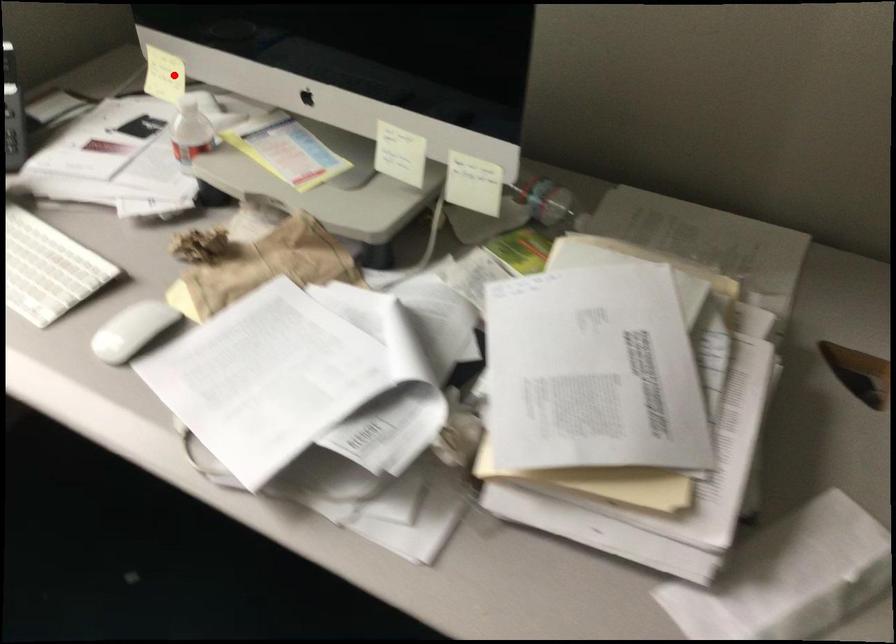
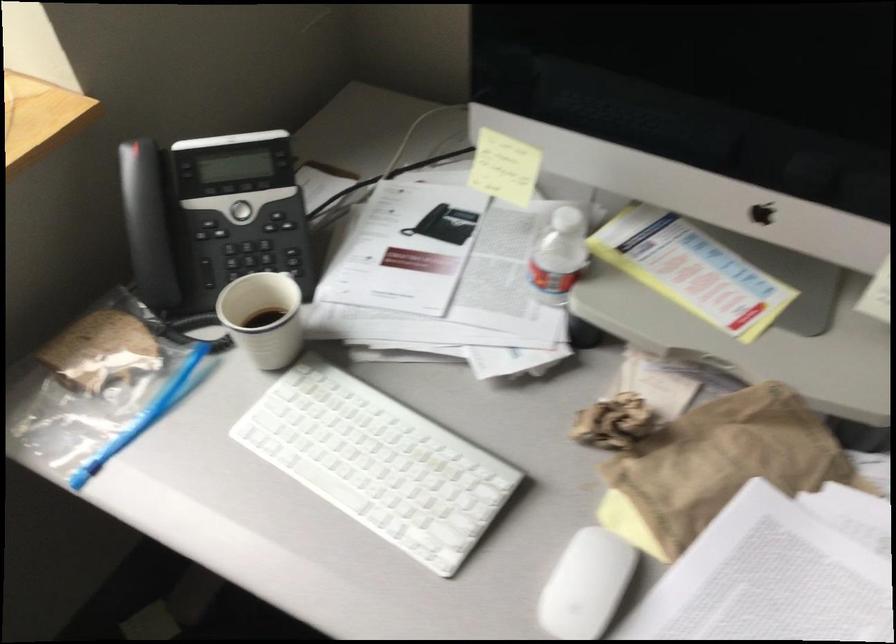
In the second image, find the point that corresponds to the highlighted location in the first image.

(504, 167)